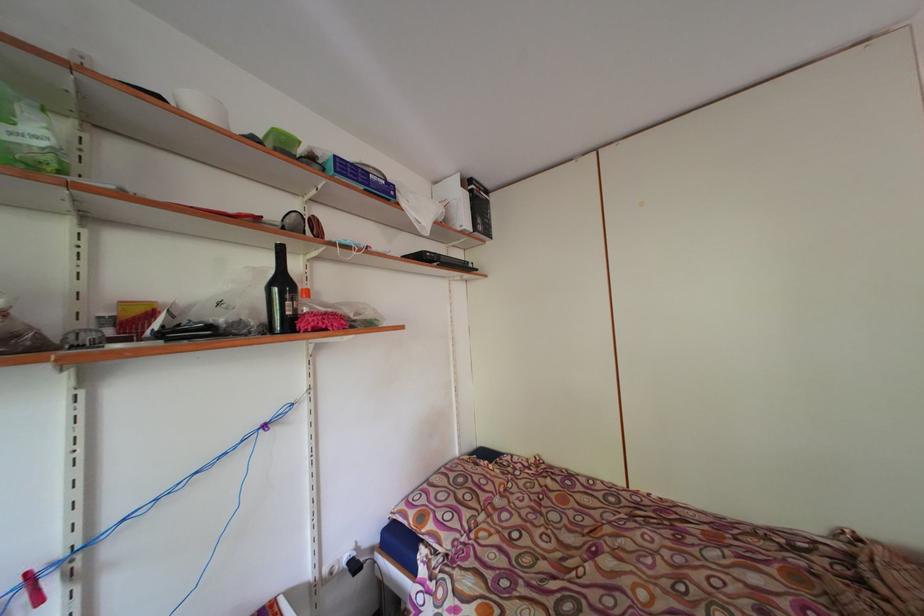
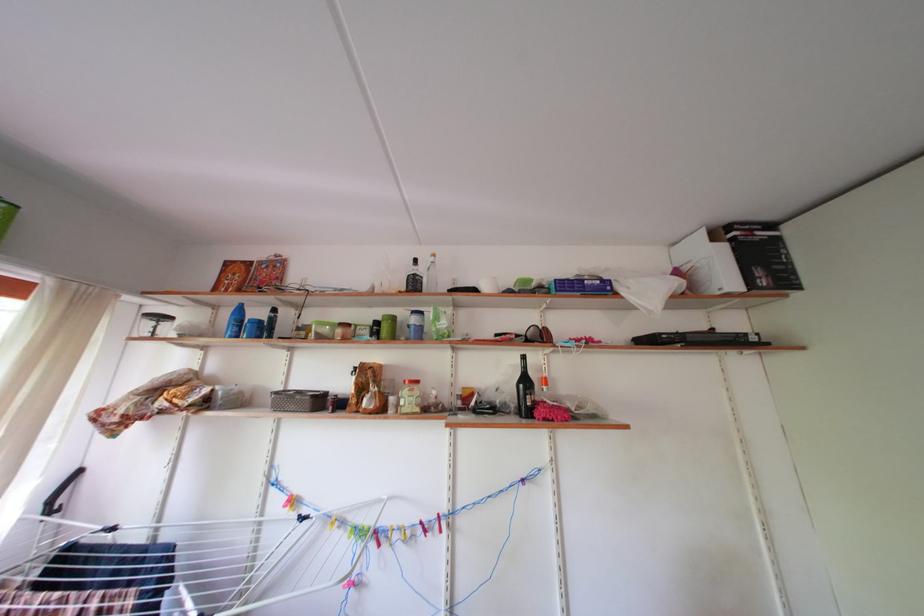
Where in the second image is the point corresponding to pixel 377 180 from the first image?

(591, 286)